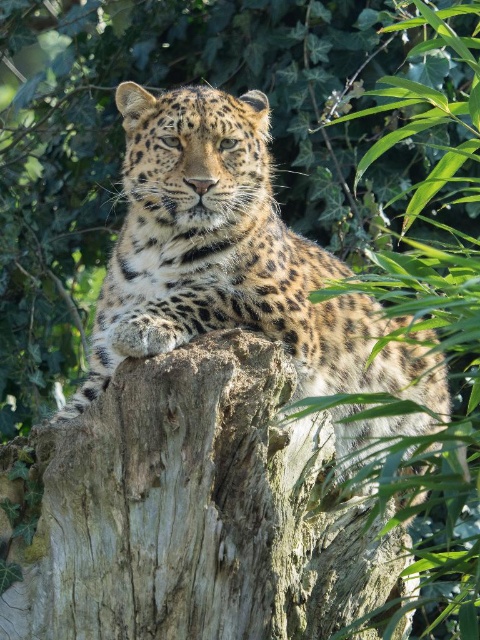
Question: Which point is closer to the camera?

Choices:
 (A) (227, 296)
 (B) (267, 595)

Answer: (B)

Question: Does brown rough bark at center appear over spotted fur leopard at center?

Choices:
 (A) yes
 (B) no

Answer: (B)

Question: Can you confirm if brown rough bark at center is positioned to the left of spotted fur leopard at center?

Choices:
 (A) yes
 (B) no

Answer: (A)

Question: Considering the relative positions of brown rough bark at center and spotted fur leopard at center in the image provided, where is brown rough bark at center located with respect to spotted fur leopard at center?

Choices:
 (A) below
 (B) above

Answer: (A)

Question: Which object is closer to the camera taking this photo?

Choices:
 (A) brown rough bark at center
 (B) spotted fur leopard at center

Answer: (B)

Question: Which point is closer to the camera?

Choices:
 (A) brown rough bark at center
 (B) spotted fur leopard at center

Answer: (B)